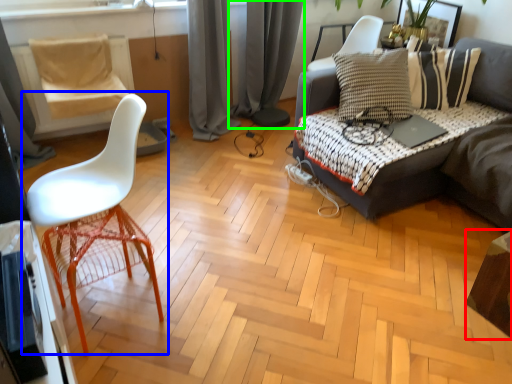
Question: Which object is the farthest from table (highlighted by a red box)? Choose among these: chair (highlighted by a blue box) or curtain (highlighted by a green box).

Choices:
 (A) chair
 (B) curtain

Answer: (B)